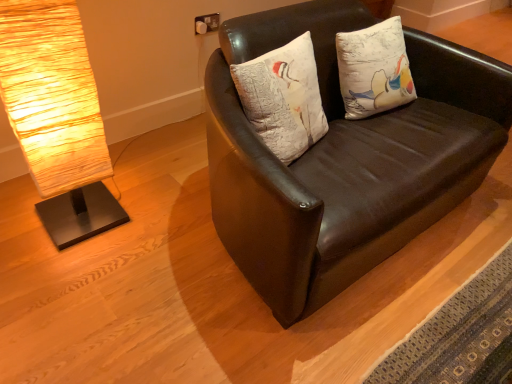
In order to click on vacant area that lies between matte brown leather couch at center and rustic wood lamp at left in this screenshot , I will do `click(159, 233)`.